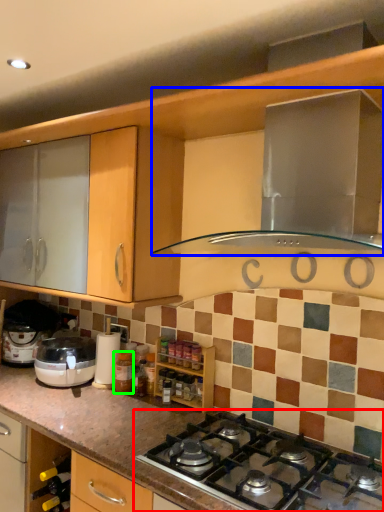
Question: Which object is positioned farthest from gas stove (highlighted by a red box)? Select from home appliance (highlighted by a blue box) and bottle (highlighted by a green box).

Choices:
 (A) home appliance
 (B) bottle

Answer: (A)